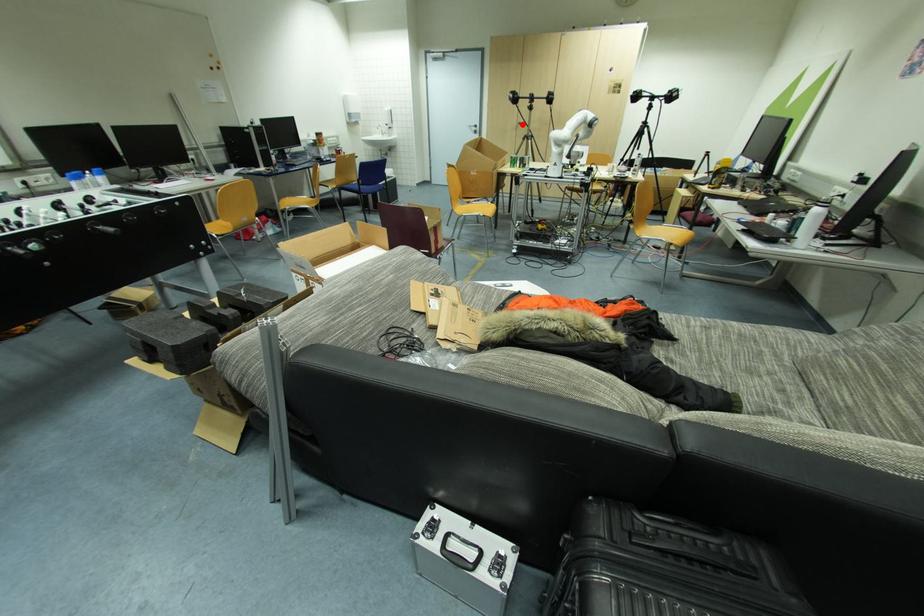
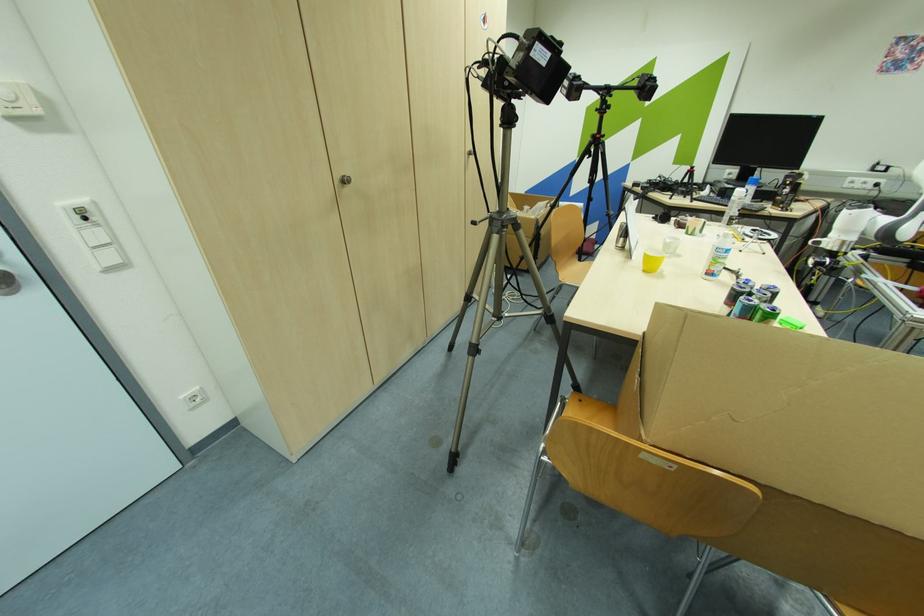
Question: I am providing you with two images of the same scene from different viewpoints. Given a red point in image1, look at the same physical point in image2. Is it:

Choices:
 (A) Closer to the viewpoint
 (B) Farther from the viewpoint

Answer: (B)